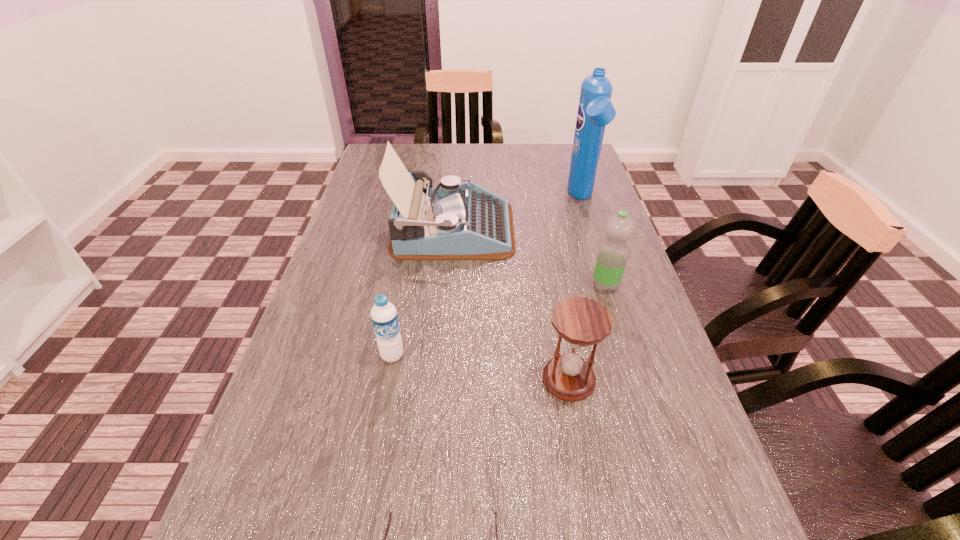
You are a GUI agent. You are given a task and a screenshot of the screen. Output one action in this format:
    pyautogui.click(x=<x>, y=<y>)
    Task: Click on the free spot between the farther water bottle and the shampoo
    The height and width of the screenshot is (540, 960).
    Given the screenshot: What is the action you would take?
    pyautogui.click(x=593, y=242)

Locate an element on the screen. The width and height of the screenshot is (960, 540). free space between the fourth nearest object and the nearer water bottle is located at coordinates (499, 320).

Image resolution: width=960 pixels, height=540 pixels. What are the coordinates of `free space between the shorter water bottle and the farther water bottle` in the screenshot? It's located at (499, 320).

Identify the location of free space that is in between the hourglass and the typewriter. The image size is (960, 540). (511, 304).

Where is `free point between the shorter water bottle and the hourglass`? free point between the shorter water bottle and the hourglass is located at coordinates (481, 367).

The width and height of the screenshot is (960, 540). I want to click on free space that is in between the typewriter and the right water bottle, so click(x=529, y=257).

I want to click on empty space between the hourglass and the typewriter, so click(x=511, y=304).

This screenshot has width=960, height=540. Find the location of `free space between the shampoo and the typewriter`. free space between the shampoo and the typewriter is located at coordinates (517, 214).

Image resolution: width=960 pixels, height=540 pixels. What are the coordinates of `object that is the fourth closest one to the shampoo` in the screenshot? It's located at (384, 317).

You are a GUI agent. You are given a task and a screenshot of the screen. Output one action in this format:
    pyautogui.click(x=<x>, y=<y>)
    Task: Click on the object that is the nearest to the shampoo
    Image resolution: width=960 pixels, height=540 pixels.
    Given the screenshot: What is the action you would take?
    pos(454,221)